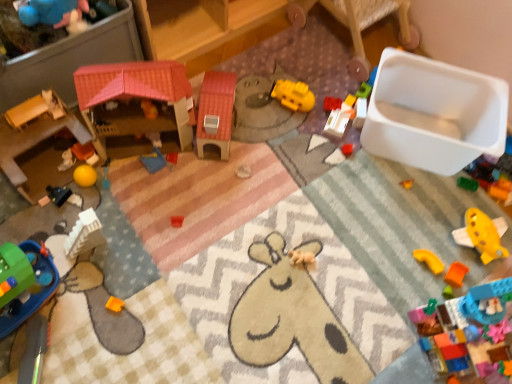
Identify the location of free space between bright red plastic blocks at center, which ranks as the ninth toy in left-to-right order, and translucent blue plastic blocks at lower right, the thirteenth toy viewed from the left. This screenshot has width=512, height=384. (394, 232).